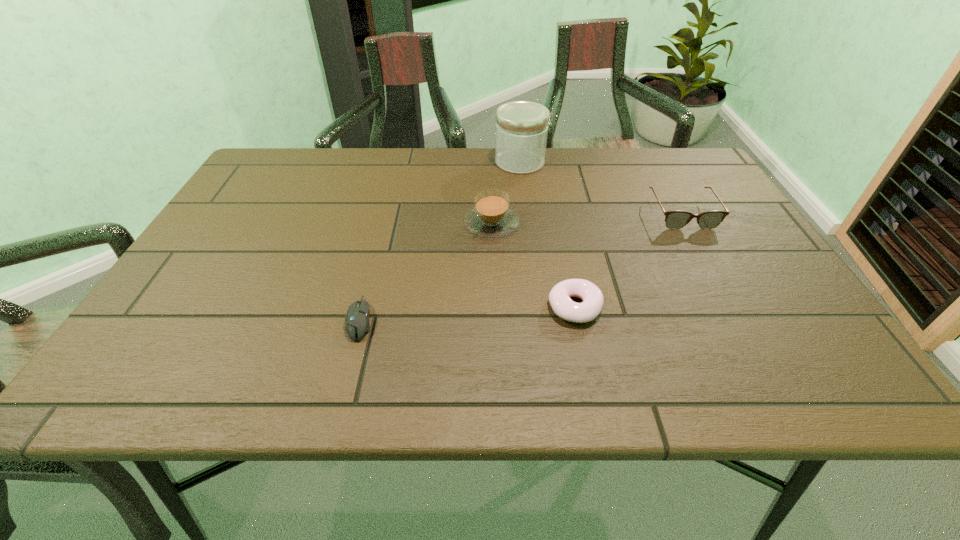
I want to click on vacant space in between the computer mouse and the jar, so click(x=440, y=240).

This screenshot has height=540, width=960. In order to click on free space between the shortest object and the cappuccino in this screenshot , I will do coord(426,271).

You are a GUI agent. You are given a task and a screenshot of the screen. Output one action in this format:
    pyautogui.click(x=<x>, y=<y>)
    Task: Click on the vacant space that is in between the leftmost object and the rightmost object
    
    Given the screenshot: What is the action you would take?
    tap(521, 266)

Find the location of `free space between the spectacles and the second tallest object`. free space between the spectacles and the second tallest object is located at coordinates (587, 219).

Image resolution: width=960 pixels, height=540 pixels. Find the location of `free space between the computer mouse and the cappuccino`. free space between the computer mouse and the cappuccino is located at coordinates (426, 271).

Locate an element on the screen. The height and width of the screenshot is (540, 960). empty location between the tallest object and the leftmost object is located at coordinates (440, 240).

Where is `free space that is in between the farthest object and the rightmost object`? The width and height of the screenshot is (960, 540). free space that is in between the farthest object and the rightmost object is located at coordinates (601, 188).

At what (x,y) coordinates should I click in order to perform the action: click on vacant space that's between the computer mouse and the doughnut. Please return your answer as a coordinate pair (x, y). Looking at the image, I should click on (468, 313).

Where is `free space between the rightmost object and the leftmost object`? This screenshot has width=960, height=540. free space between the rightmost object and the leftmost object is located at coordinates (521, 266).

Identify the location of object that is the second closest to the farthest object. (676, 219).